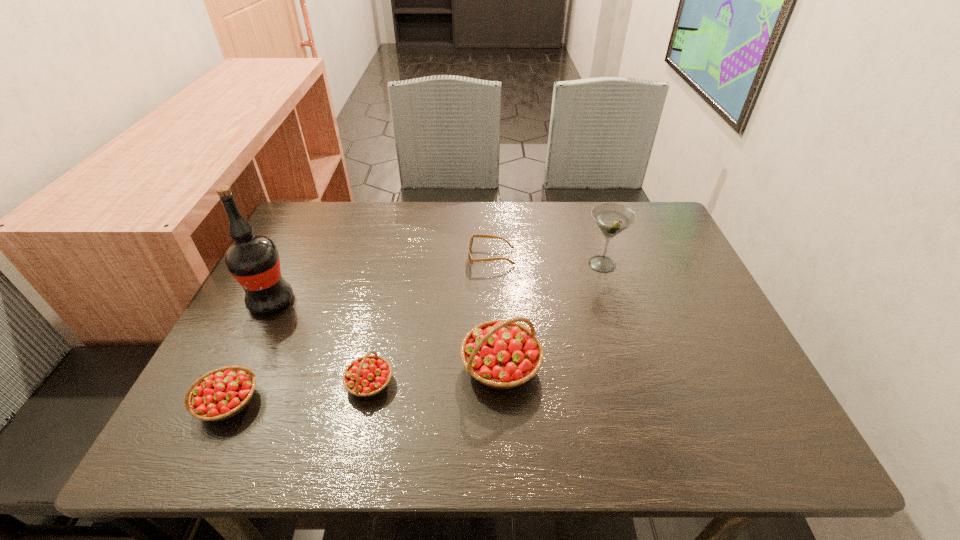
This screenshot has height=540, width=960. I want to click on strawberry present at the left edge, so click(x=220, y=394).

Where is `wine bottle that is positioned at the left edge`? Image resolution: width=960 pixels, height=540 pixels. wine bottle that is positioned at the left edge is located at coordinates (253, 260).

You are a GUI agent. You are given a task and a screenshot of the screen. Output one action in this format:
    pyautogui.click(x=<x>, y=<y>)
    Task: Click on the object at the near left corner
    The height and width of the screenshot is (540, 960).
    Given the screenshot: What is the action you would take?
    pyautogui.click(x=220, y=394)

The width and height of the screenshot is (960, 540). I want to click on vacant space at the far edge of the desktop, so click(548, 247).

Locate an element on the screen. The height and width of the screenshot is (540, 960). free space at the near edge of the desktop is located at coordinates (283, 403).

At what (x,y) coordinates should I click in order to perform the action: click on free space at the left edge of the desktop. Please return your answer as a coordinate pair (x, y). Image resolution: width=960 pixels, height=540 pixels. Looking at the image, I should click on (298, 253).

This screenshot has width=960, height=540. In the image, there is a desktop. In order to click on free region at the right edge in this screenshot , I will do `click(722, 326)`.

The height and width of the screenshot is (540, 960). In the image, there is a desktop. In order to click on vacant space at the far right corner in this screenshot , I will do `click(645, 204)`.

Locate an element on the screen. This screenshot has height=540, width=960. blank region between the tallest object and the fifth tallest object is located at coordinates click(321, 342).

Find the location of a particular element. This screenshot has height=540, width=960. free space between the sunglasses and the shortest strawberry is located at coordinates (431, 320).